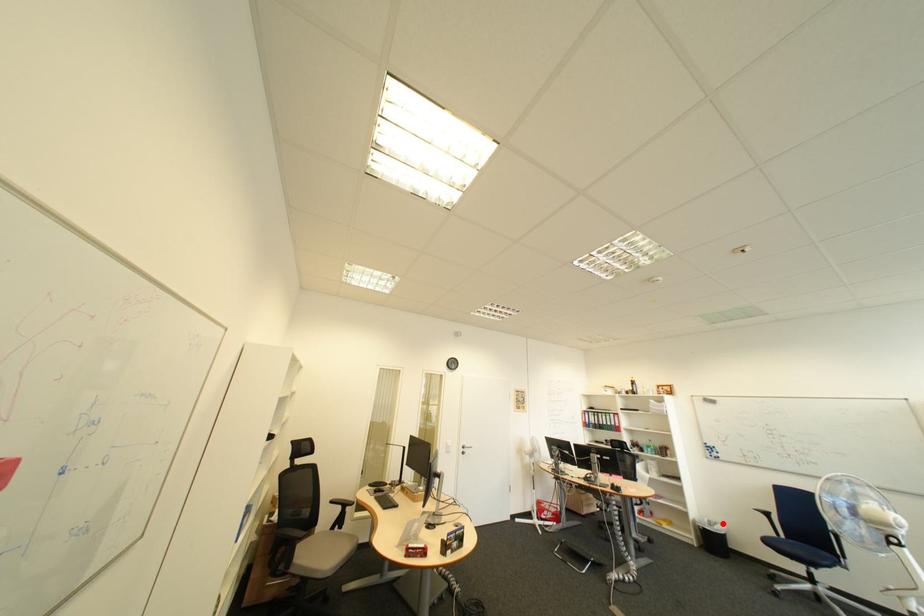
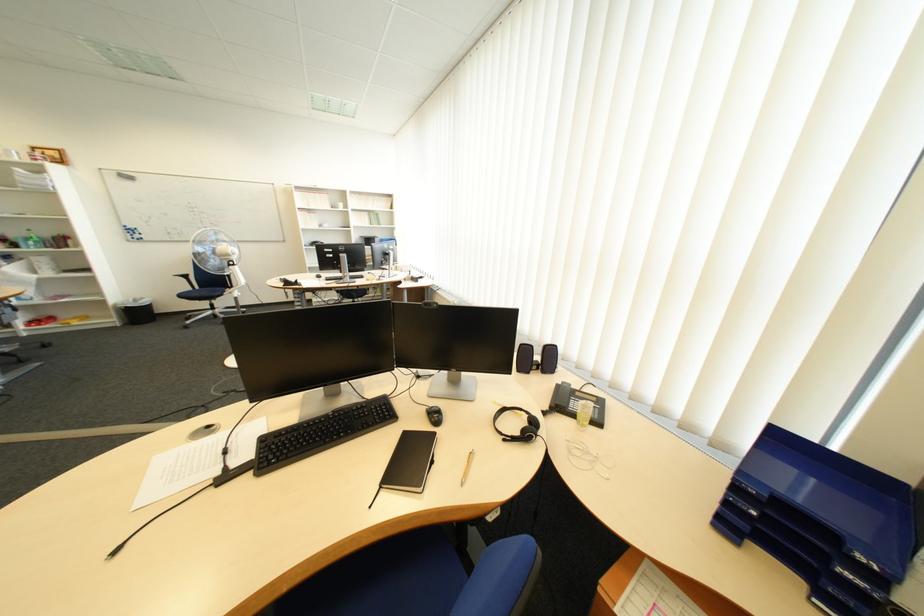
Question: I am providing you with two images of the same scene from different viewpoints. In image1, a red point is highlighted. Considering the same 3D point in image2, which of the following is correct?

Choices:
 (A) It is closer
 (B) It is farther

Answer: (B)